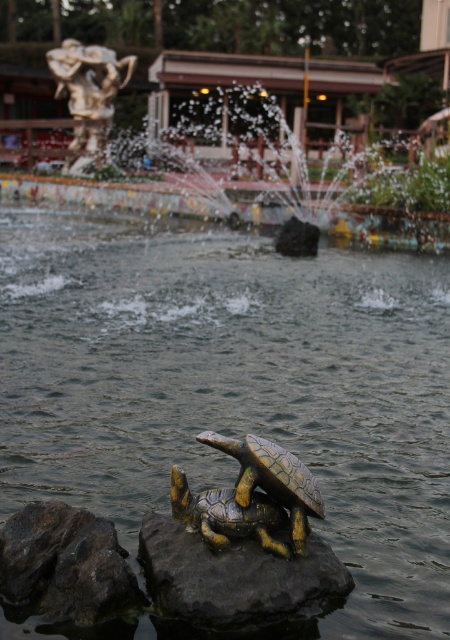
Question: Can you confirm if shiny bronze tortoise at center is positioned to the right of yellow matte tortoise at center?

Choices:
 (A) no
 (B) yes

Answer: (B)

Question: Which of the following is the closest to the observer?

Choices:
 (A) (171, 342)
 (B) (242, 561)

Answer: (B)

Question: Can you confirm if shiny bronze tortoise at center is positioned below yellow matte tortoise at center?

Choices:
 (A) no
 (B) yes

Answer: (A)

Question: Which of the following is the closest to the observer?

Choices:
 (A) (289, 497)
 (B) (334, 572)
 (C) (57, 464)
 (D) (220, 531)

Answer: (B)

Question: Which object is positioned farthest from the yellow matte tortoise at center?

Choices:
 (A) greenish-gray water at center
 (B) dark gray stone at center
 (C) shiny bronze tortoise at center

Answer: (A)

Question: Can you confirm if dark gray stone at center is thinner than yellow matte tortoise at center?

Choices:
 (A) yes
 (B) no

Answer: (B)